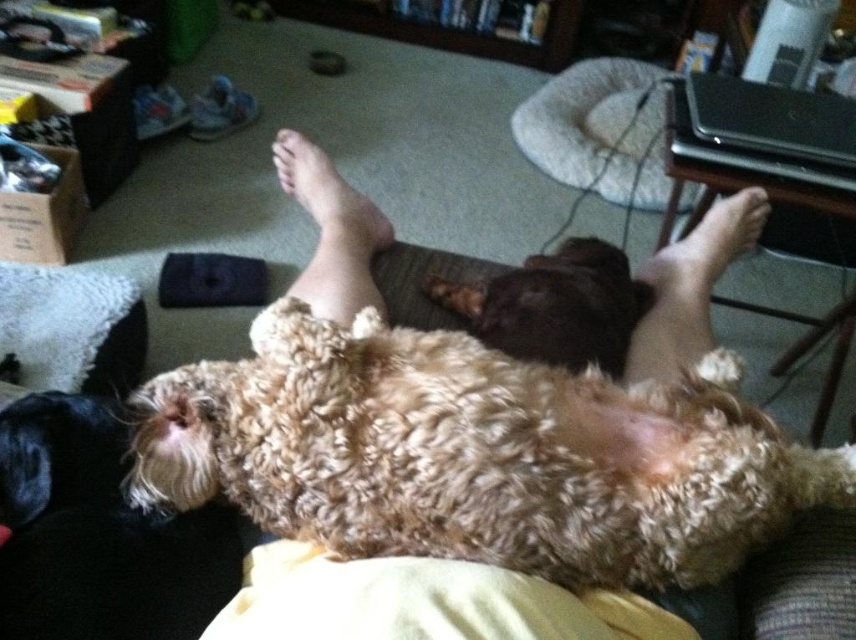
Is brown furry foot at lower right below skinny flesh at center?

Indeed, brown furry foot at lower right is positioned under skinny flesh at center.

Between point (694, 284) and point (367, 212), which one is positioned behind?

The point (367, 212) is behind.

Does point (684, 362) lie in front of point (308, 182)?

That is True.

The width and height of the screenshot is (856, 640). Identify the location of brown furry foot at lower right. (690, 285).

Does fuzzy brown dog at center have a lesser height compared to beige plush dog bed at upper center?

Yes, fuzzy brown dog at center is shorter than beige plush dog bed at upper center.

Is point (783, 497) positioned before point (544, 115)?

Yes.

Does point (419, 508) come closer to viewer compared to point (560, 148)?

That is True.

The width and height of the screenshot is (856, 640). Find the location of `fuzzy brown dog at center`. fuzzy brown dog at center is located at coordinates (477, 452).

Where is `beige plush dog bed at upper center`? This screenshot has width=856, height=640. beige plush dog bed at upper center is located at coordinates (598, 129).

In the scene shown: Is beige plush dog bed at upper center further to camera compared to brown furry foot at lower right?

Yes, it is behind brown furry foot at lower right.

Who is more distant from viewer, (596,163) or (658,310)?

Positioned behind is point (596,163).

Find the location of a particular element. beige plush dog bed at upper center is located at coordinates (598, 129).